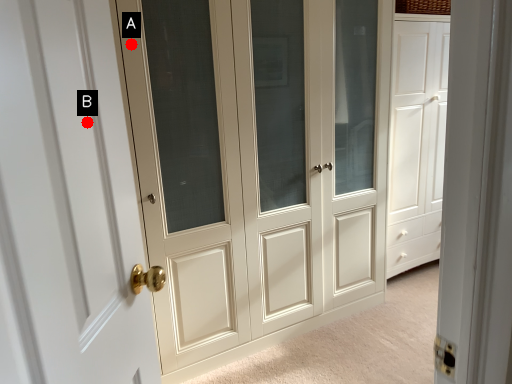
Question: Two points are circled on the image, labeled by A and B beside each circle. Which point is closer to the camera?

Choices:
 (A) A is closer
 (B) B is closer

Answer: (B)